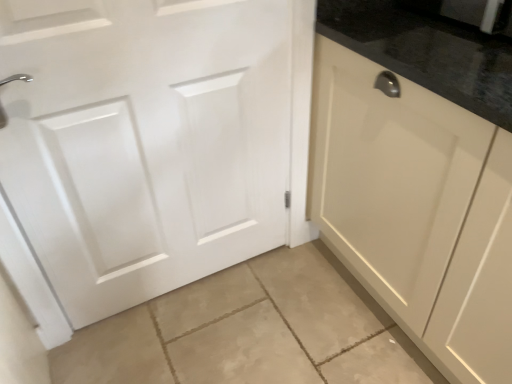
Question: Is white matte door at left bigger or smaller than matte cream cabinet at right?

Choices:
 (A) big
 (B) small

Answer: (B)

Question: From a real-world perspective, relative to matte cream cabinet at right, is white matte door at left vertically above or below?

Choices:
 (A) below
 (B) above

Answer: (B)

Question: Considering the positions of white matte door at left and matte cream cabinet at right in the image, is white matte door at left wider or thinner than matte cream cabinet at right?

Choices:
 (A) wide
 (B) thin

Answer: (B)

Question: In terms of width, does matte cream cabinet at right look wider or thinner when compared to white matte door at left?

Choices:
 (A) wide
 (B) thin

Answer: (A)

Question: From the image's perspective, is matte cream cabinet at right located above or below white matte door at left?

Choices:
 (A) above
 (B) below

Answer: (B)

Question: Looking at the image, does matte cream cabinet at right seem bigger or smaller compared to white matte door at left?

Choices:
 (A) big
 (B) small

Answer: (A)

Question: In terms of height, does matte cream cabinet at right look taller or shorter compared to white matte door at left?

Choices:
 (A) short
 (B) tall

Answer: (A)